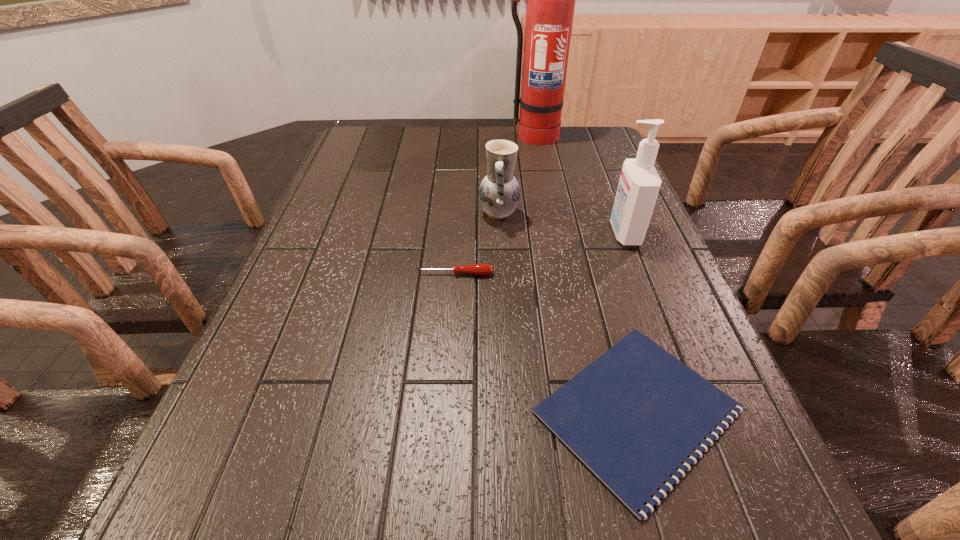
Locate an element on the screen. The width and height of the screenshot is (960, 540). notepad present at the right edge is located at coordinates (632, 416).

Locate an element on the screen. The height and width of the screenshot is (540, 960). object at the near right corner is located at coordinates (632, 416).

I want to click on vacant space at the far edge of the desktop, so click(x=479, y=140).

Image resolution: width=960 pixels, height=540 pixels. Find the location of `vacant point at the near edge`. vacant point at the near edge is located at coordinates point(418,533).

Find the location of `vacant space at the left edge of the desktop`. vacant space at the left edge of the desktop is located at coordinates (225, 397).

This screenshot has width=960, height=540. Identify the location of free space at the right edge of the desktop. (636, 276).

You are a GUI agent. You are given a task and a screenshot of the screen. Output one action in this format:
    pyautogui.click(x=<x>, y=<y>)
    Task: Click on the free region at the far left corner
    
    Given the screenshot: What is the action you would take?
    pyautogui.click(x=354, y=131)

Where is `blank space at the far right corner of the desktop`? This screenshot has height=540, width=960. blank space at the far right corner of the desktop is located at coordinates coord(602,130).

The width and height of the screenshot is (960, 540). Identify the location of free spot between the third shortest object and the fourth farthest object. (477, 244).

At what (x,y) coordinates should I click in order to perform the action: click on free space between the nearest object and the cleansing agent. Please return your answer as a coordinate pair (x, y). The width and height of the screenshot is (960, 540). Looking at the image, I should click on (631, 322).